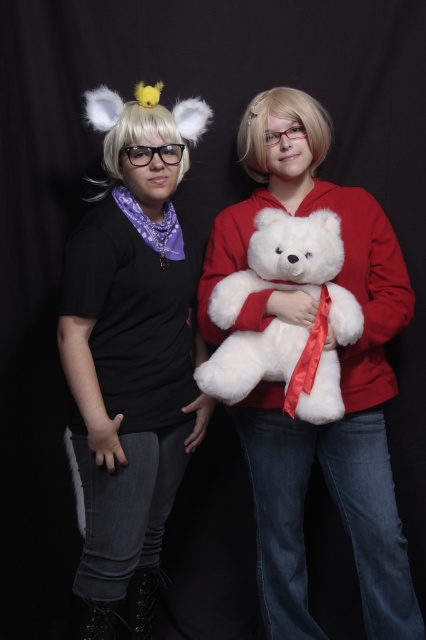
You are standing in front of the image and want to touch the fuzzy white wig at left. If your arm can reach up to 5 feet, can you reach it?

The fuzzy white wig at left and the viewer are 5.16 feet apart from each other. Since your arm can only reach up to 5 feet, you cannot reach the fuzzy white wig at left.

You are a photographer trying to capture a clear photo of both the fuzzy white wig at left and the white plush bear at center. Since you want both subjects to be in focus, which one should you adjust your camera focus on first?

You should focus on the fuzzy white wig at left first because it is closer to the viewer than the white plush bear at center, ensuring both will be in focus when using depth of field properly.